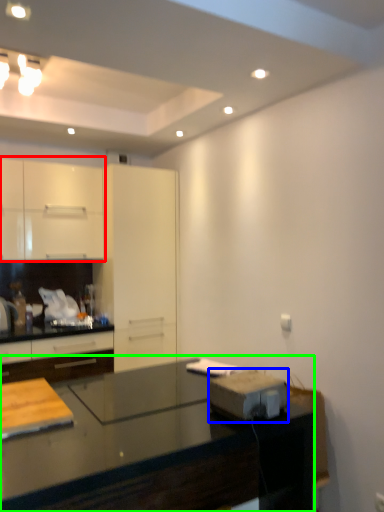
Question: Considering the real-world distances, which object is farthest from cabinetry (highlighted by a red box)? appliance (highlighted by a blue box) or countertop (highlighted by a green box)?

Choices:
 (A) appliance
 (B) countertop

Answer: (A)